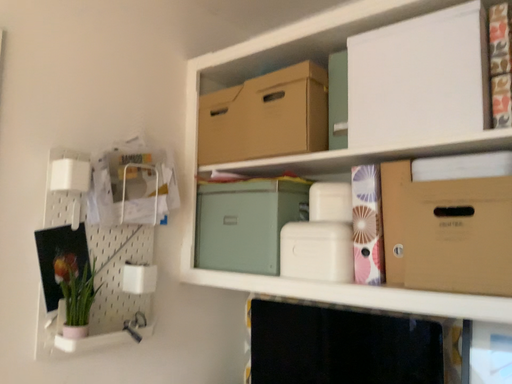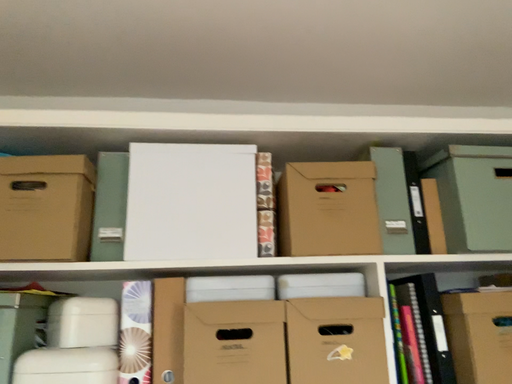
Question: How did the camera likely rotate when shooting the video?

Choices:
 (A) rotated downward
 (B) rotated upward

Answer: (B)